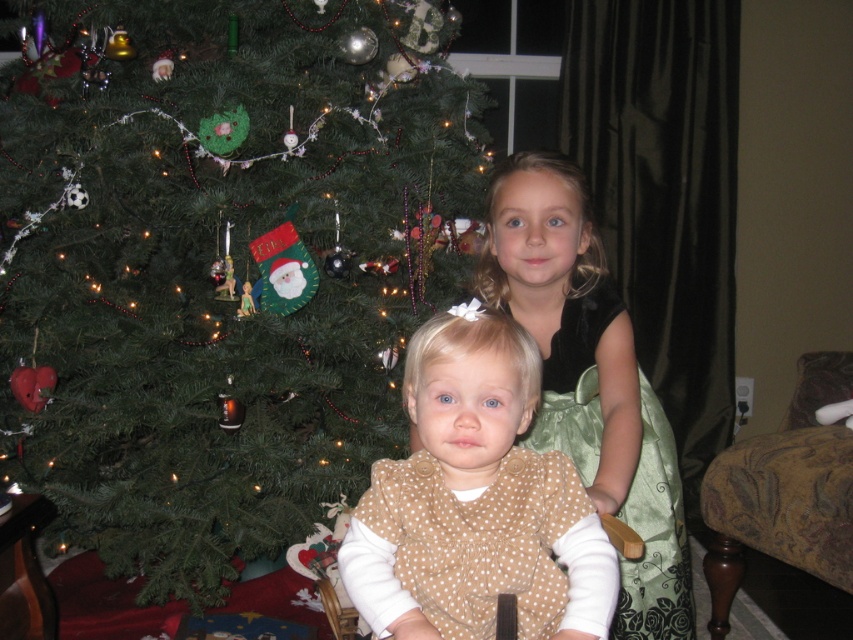
Question: Does brown polka dot dress at center appear on the right side of patterned fabric rocking chair at lower right?

Choices:
 (A) yes
 (B) no

Answer: (B)

Question: Considering the real-world distances, which object is farthest from the brown polka dot dress at center?

Choices:
 (A) green satin dress at upper right
 (B) patterned fabric rocking chair at lower right
 (C) green matte christmas tree at center

Answer: (B)

Question: Does green satin dress at upper right come behind patterned fabric rocking chair at lower right?

Choices:
 (A) no
 (B) yes

Answer: (A)

Question: Can you confirm if green matte christmas tree at center is bigger than green satin dress at upper right?

Choices:
 (A) yes
 (B) no

Answer: (A)

Question: Which point is closer to the camera taking this photo?

Choices:
 (A) (195, 266)
 (B) (608, 397)

Answer: (B)

Question: Which object is the closest to the patterned fabric rocking chair at lower right?

Choices:
 (A) green matte christmas tree at center
 (B) brown polka dot dress at center
 (C) green satin dress at upper right

Answer: (C)